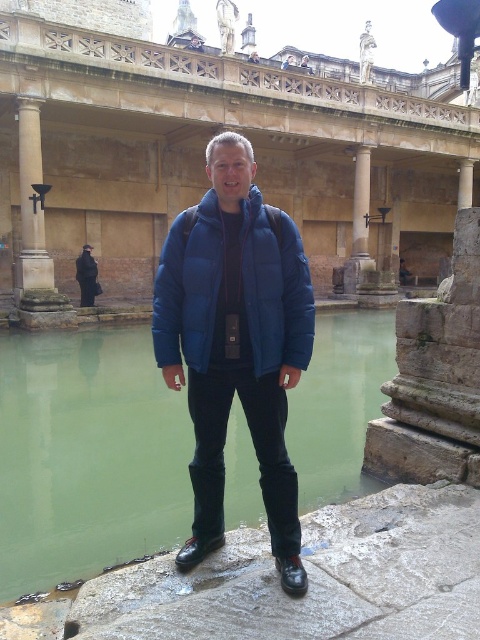
Question: Which object appears closest to the camera in this image?

Choices:
 (A) matte blue jacket at center
 (B) blue puffy jacket at center
 (C) green stone pool at center

Answer: (B)

Question: Which point is closer to the camera?

Choices:
 (A) beige stone column at left
 (B) green stone pool at center
 (C) beige stone pillar at center
 (D) matte blue coat at center

Answer: (B)

Question: Is matte stone palace at center thinner than blue puffy jacket at center?

Choices:
 (A) yes
 (B) no

Answer: (B)

Question: Which point is farther from the camera taking this photo?

Choices:
 (A) (95, 272)
 (B) (31, 164)
 (C) (361, 204)

Answer: (C)

Question: Does matte blue jacket at center have a lesser width compared to matte blue coat at center?

Choices:
 (A) yes
 (B) no

Answer: (B)

Question: Does matte blue jacket at center have a greater width compared to beige stone pillar at center?

Choices:
 (A) yes
 (B) no

Answer: (A)